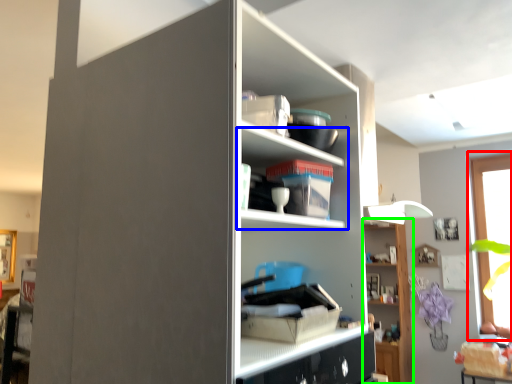
Question: Estimate the real-world distances between objects in this image. Which object is closer to window (highlighted by a red box), shelf (highlighted by a blue box) or shelf (highlighted by a green box)?

Choices:
 (A) shelf
 (B) shelf

Answer: (B)